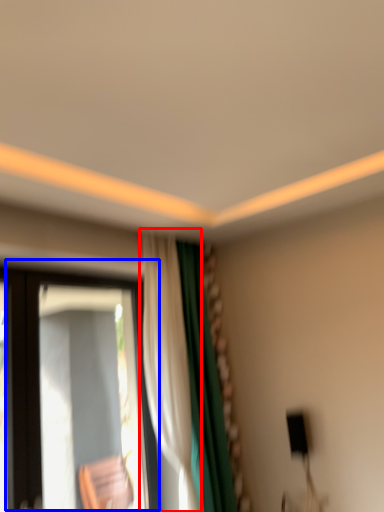
Question: Among these objects, which one is farthest to the camera, curtain (highlighted by a red box) or window (highlighted by a blue box)?

Choices:
 (A) curtain
 (B) window

Answer: (A)